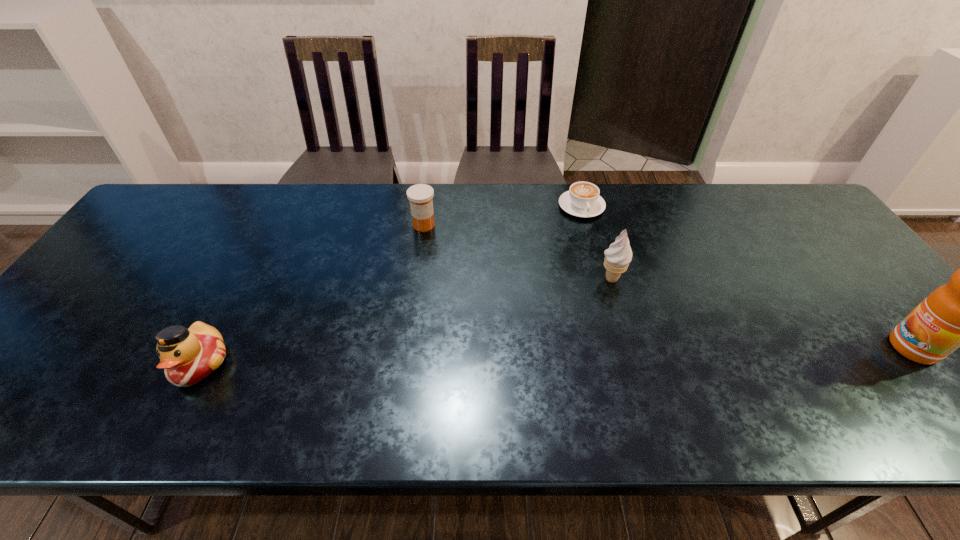
At what (x,y) coordinates should I click in order to perform the action: click on free space on the desktop that is between the duck and the fruit juice and is positioned on the front-facing side of the icecream. Please return your answer as a coordinate pair (x, y). The width and height of the screenshot is (960, 540). Looking at the image, I should click on (473, 357).

Image resolution: width=960 pixels, height=540 pixels. Identify the location of vacant spot on the desktop that is between the leftmost object and the rightmost object and is positioned on the side of the shortest object with the handle. (635, 354).

At what (x,y) coordinates should I click in order to perform the action: click on vacant space on the desktop that is between the duck and the tallest object and is positioned on the label of the medicine. Please return your answer as a coordinate pair (x, y). Image resolution: width=960 pixels, height=540 pixels. Looking at the image, I should click on (470, 357).